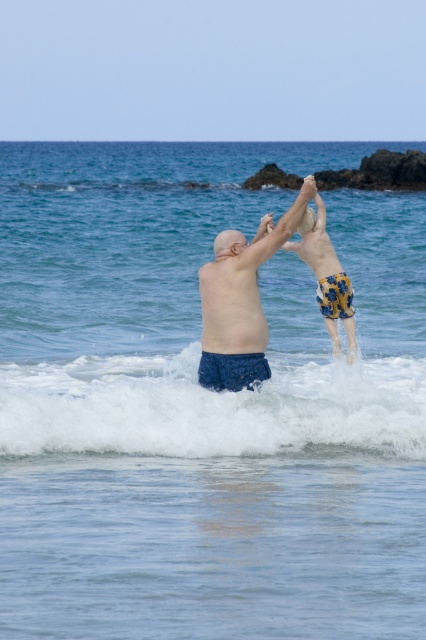
You are a photographer trying to capture the perfect shot of the white foamy wave at center and the blue fabric shorts at center. Which object is wider in the image?

The white foamy wave at center is wider than the blue fabric shorts at center.

You are a drone operator trying to capture a photo of the two people in the ocean. You have two points marked as reference points for the camera. The first point is at coordinates point (52, 420), and the second point is at coordinates point (344, 308). If you want to ensure both people are in the frame, which point should you prioritize positioning the camera closer to?

You should prioritize positioning the camera closer to point (52, 420) because it is in front of point (344, 308), making it closer to the camera and ensuring both subjects are visible in the frame.

You are a photographer taking a beach photo and need to ensure both the blue fabric shorts at center and the blue textured shorts at center are visible in the frame. Which of these two shorts should you focus on to ensure they are both in the frame?

The blue fabric shorts at center is shorter than blue textured shorts at center, so focusing on the blue textured shorts at center will ensure both are visible since it is taller.